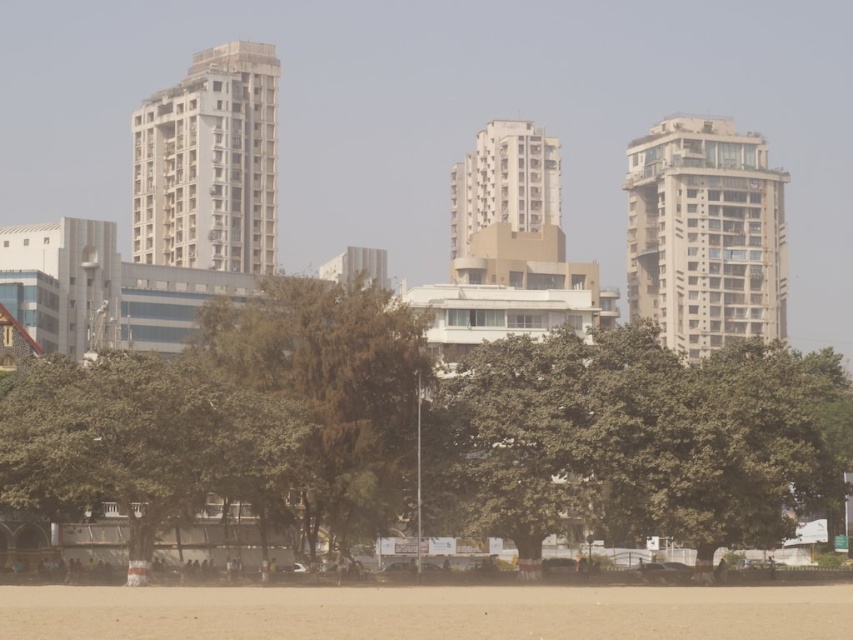
Is point (509, 445) more distant than point (227, 113)?

No, it is not.

Which of these two, green leafy tree at center or white concrete building at center, stands shorter?

A: Standing shorter between the two is green leafy tree at center.

Measure the distance between green leafy tree at center and camera.

The distance of green leafy tree at center from camera is 70.96 meters.

The width and height of the screenshot is (853, 640). In order to click on green leafy tree at center in this screenshot , I will do `click(643, 436)`.

Does brown sandy dirt field at lower center have a lesser height compared to beige concrete building at center?

Indeed, brown sandy dirt field at lower center has a lesser height compared to beige concrete building at center.

Is point (576, 632) positioned behind point (515, 230)?

No, it is not.

The width and height of the screenshot is (853, 640). I want to click on brown sandy dirt field at lower center, so click(x=426, y=612).

Is brown sandy dirt field at lower center positioned in front of white concrete building at center?

Yes, it is.

Which is in front, point (566, 636) or point (254, 132)?

Point (566, 636) is in front.

Image resolution: width=853 pixels, height=640 pixels. What do you see at coordinates (426, 612) in the screenshot? I see `brown sandy dirt field at lower center` at bounding box center [426, 612].

The height and width of the screenshot is (640, 853). What are the coordinates of `brown sandy dirt field at lower center` in the screenshot? It's located at (426, 612).